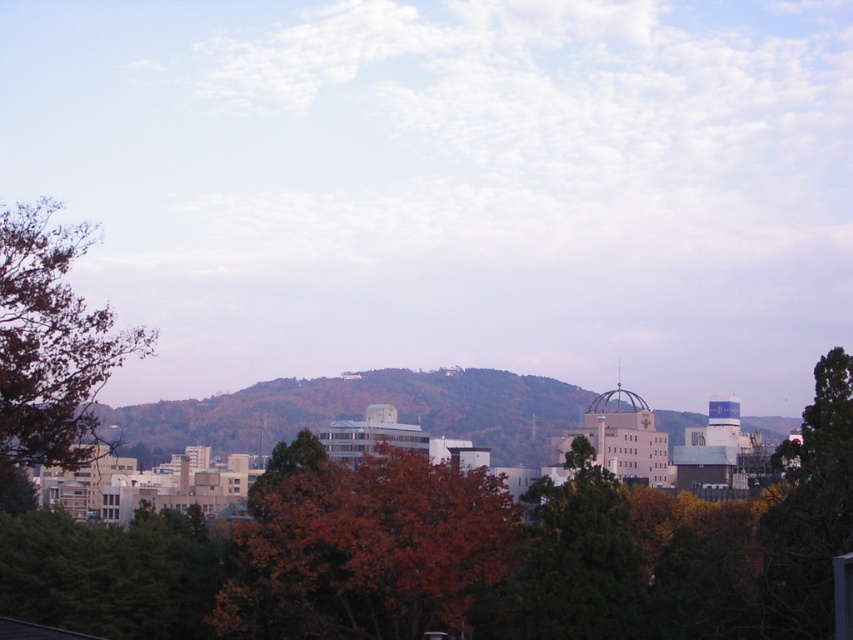
You are an architect analyzing the cityscape. You notice the orange matte tree at center and the brown leafy tree at left. Which tree appears closer to you in the image?

The orange matte tree at center appears closer to you because it is further to the viewer than the brown leafy tree at left, meaning it occupies a more foreground position in the scene.

You are an urban planner reviewing this cityscape. You need to determine which object, the green leafy hillside at center or the green matte tree at center, is positioned lower in the image. Based on the scene, which one is lower?

The green leafy hillside at center is located below the green matte tree at center, so the green leafy hillside at center is positioned lower in the image.